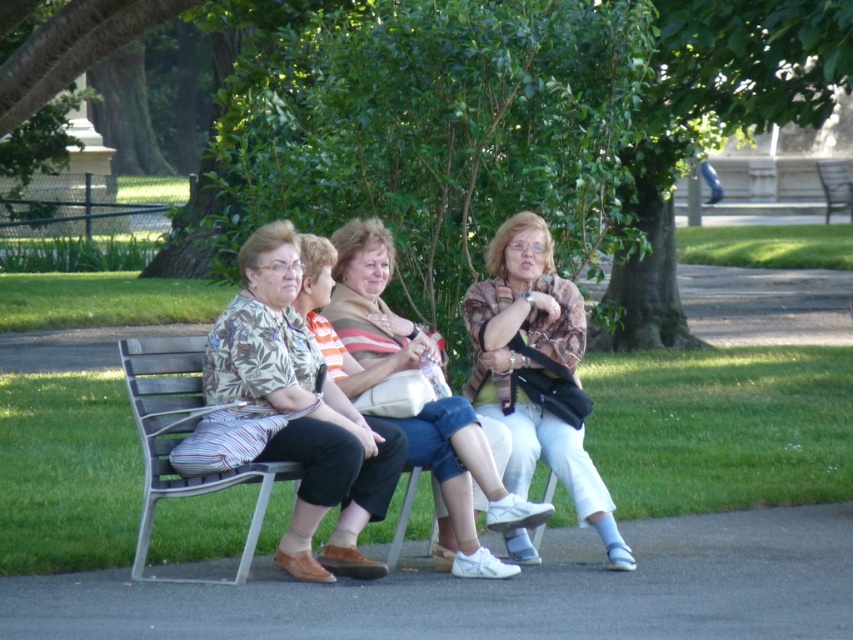
Question: Can you confirm if striped fabric purse at center is thinner than wooden park bench at right?

Choices:
 (A) no
 (B) yes

Answer: (A)

Question: Is printed fabric blouse at center in front of striped fabric purse at center?

Choices:
 (A) yes
 (B) no

Answer: (A)

Question: Is the position of metallic gray bench at left more distant than that of wooden park bench at right?

Choices:
 (A) yes
 (B) no

Answer: (B)

Question: Which object appears farthest from the camera in this image?

Choices:
 (A) wooden park bench at right
 (B) green leafy tree at center
 (C) wooden bench at center

Answer: (A)

Question: Which of the following is the farthest from the observer?

Choices:
 (A) click(469, 529)
 (B) click(520, 308)
 (C) click(299, 337)

Answer: (B)

Question: Which of the following is the closest to the observer?

Choices:
 (A) (154, 339)
 (B) (849, 28)
 (C) (341, 396)

Answer: (A)